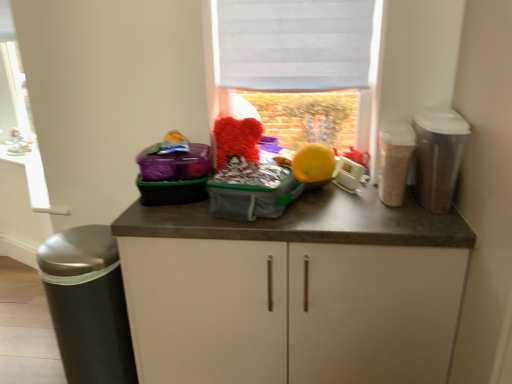
Identify the location of free location to the left of translucent plastic canister at right, the first appliance when ordered from right to left. (364, 211).